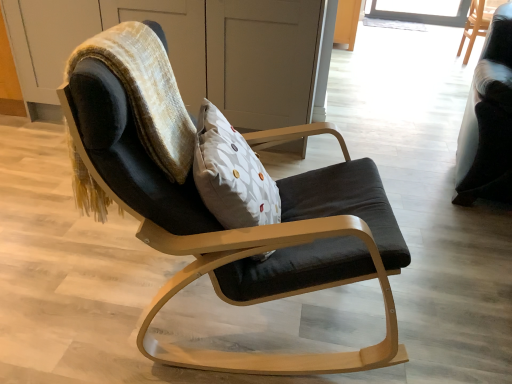
Question: Is matte wood dresser at center wider than velvet black bean bag chair at upper left?

Choices:
 (A) yes
 (B) no

Answer: (A)

Question: Is velvet black bean bag chair at upper left inside matte wood dresser at center?

Choices:
 (A) no
 (B) yes

Answer: (A)

Question: Is matte wood dresser at center oriented towards velvet black bean bag chair at upper left?

Choices:
 (A) no
 (B) yes

Answer: (B)

Question: Is the position of matte wood dresser at center more distant than that of velvet black bean bag chair at upper left?

Choices:
 (A) no
 (B) yes

Answer: (B)

Question: Does matte wood dresser at center have a lesser width compared to velvet black bean bag chair at upper left?

Choices:
 (A) yes
 (B) no

Answer: (B)

Question: From the image's perspective, is velvet black bean bag chair at upper left positioned above or below white dotted pillow at center?

Choices:
 (A) below
 (B) above

Answer: (B)

Question: Considering the relative positions of velvet black bean bag chair at upper left and white dotted pillow at center in the image provided, is velvet black bean bag chair at upper left to the left or to the right of white dotted pillow at center?

Choices:
 (A) left
 (B) right

Answer: (A)

Question: Is velvet black bean bag chair at upper left spatially inside white dotted pillow at center, or outside of it?

Choices:
 (A) outside
 (B) inside

Answer: (A)

Question: From a real-world perspective, is velvet black bean bag chair at upper left above or below white dotted pillow at center?

Choices:
 (A) below
 (B) above

Answer: (B)

Question: In terms of size, does black fabric chair at upper right, positioned as the third chair in left-to-right order, appear bigger or smaller than velvet black bean bag chair at upper left?

Choices:
 (A) big
 (B) small

Answer: (A)

Question: Is black fabric chair at upper right, positioned as the 3th chair in front-to-back order, taller or shorter than velvet black bean bag chair at upper left?

Choices:
 (A) short
 (B) tall

Answer: (B)

Question: In the image, is black fabric chair at upper right, positioned as the third chair in left-to-right order, positioned in front of or behind velvet black bean bag chair at upper left?

Choices:
 (A) behind
 (B) front

Answer: (A)

Question: Is black fabric chair at upper right, which appears as the 1th chair when viewed from the back, inside or outside of velvet black bean bag chair at upper left?

Choices:
 (A) outside
 (B) inside

Answer: (A)

Question: In terms of height, does matte wood dresser at center look taller or shorter compared to black fabric chair at upper right, positioned as the third chair in left-to-right order?

Choices:
 (A) tall
 (B) short

Answer: (A)

Question: Is matte wood dresser at center bigger or smaller than black fabric chair at upper right, positioned as the 3th chair in front-to-back order?

Choices:
 (A) small
 (B) big

Answer: (B)